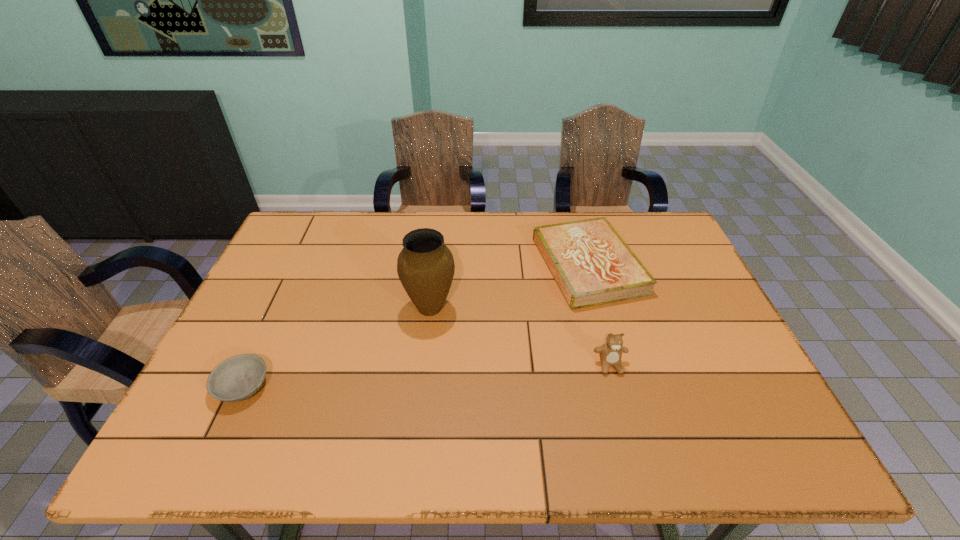
The height and width of the screenshot is (540, 960). Find the location of `object that is at the far edge`. object that is at the far edge is located at coordinates click(x=592, y=265).

Image resolution: width=960 pixels, height=540 pixels. I want to click on object that is at the left edge, so click(237, 378).

I want to click on object positioned at the right edge, so click(592, 265).

The width and height of the screenshot is (960, 540). Identify the location of object at the far right corner. (592, 265).

Locate an element on the screen. Image resolution: width=960 pixels, height=540 pixels. free space at the far edge of the desktop is located at coordinates (372, 226).

This screenshot has width=960, height=540. Identify the location of free space at the near edge of the desktop. (491, 440).

I want to click on free point at the left edge, so click(x=189, y=418).

In the image, there is a desktop. Where is `free space at the right edge`? Image resolution: width=960 pixels, height=540 pixels. free space at the right edge is located at coordinates (655, 266).

This screenshot has height=540, width=960. Identify the location of free space at the far left corner of the desktop. (296, 234).

Where is `vacant space at the far right corner of the desktop`? Image resolution: width=960 pixels, height=540 pixels. vacant space at the far right corner of the desktop is located at coordinates (636, 239).